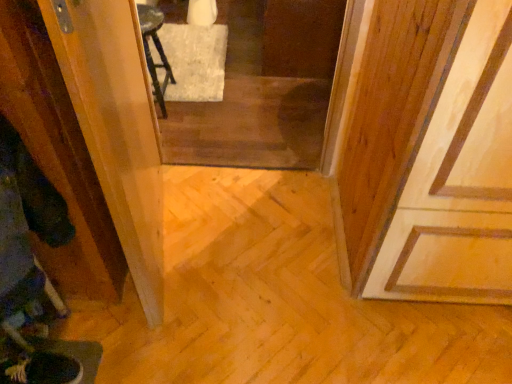
Looking at this image, in order to face transparent glass screen door at center, the 2th screen door positioned from the front, should I rotate leftwards or rightwards?

A 0.044 degree turn to the right will do.

Where is `transparent glass screen door at center, which is the first screen door from back to front`? transparent glass screen door at center, which is the first screen door from back to front is located at coordinates (263, 89).

The image size is (512, 384). Describe the element at coordinates (263, 89) in the screenshot. I see `transparent glass screen door at center, the 1th screen door viewed from the right` at that location.

What do you see at coordinates (116, 126) in the screenshot? This screenshot has width=512, height=384. I see `transparent plastic screen door at left, which ranks as the 1th screen door in front-to-back order` at bounding box center [116, 126].

Image resolution: width=512 pixels, height=384 pixels. Identify the location of transparent plastic screen door at left, which ranks as the 1th screen door in front-to-back order. (116, 126).

In order to face transparent plastic screen door at left, arranged as the 1th screen door when viewed from the left, should I rotate leftwards or rightwards?

You should look left and rotate roughly 14.684 degrees.

What is the approximate width of transparent plastic screen door at left, placed as the 2th screen door when sorted from right to left?

transparent plastic screen door at left, placed as the 2th screen door when sorted from right to left, is 9.73 centimeters wide.

I want to click on transparent glass screen door at center, arranged as the second screen door when viewed from the left, so click(x=263, y=89).

Considering the positions of objects transparent glass screen door at center, the 1th screen door viewed from the right, and transparent plastic screen door at left, the second screen door in the back-to-front sequence, in the image provided, who is more to the right, transparent glass screen door at center, the 1th screen door viewed from the right, or transparent plastic screen door at left, the second screen door in the back-to-front sequence,?

transparent glass screen door at center, the 1th screen door viewed from the right, is more to the right.

Is transparent glass screen door at center, arranged as the second screen door when viewed from the left, positioned in front of transparent plastic screen door at left, arranged as the 1th screen door when viewed from the left?

No, it is behind transparent plastic screen door at left, arranged as the 1th screen door when viewed from the left.

Which is closer, (180, 161) or (110, 56)?

Point (180, 161) is positioned farther from the camera compared to point (110, 56).

From the image's perspective, does transparent glass screen door at center, the 1th screen door viewed from the right, appear higher than transparent plastic screen door at left, the second screen door in the back-to-front sequence?

Yes, from the image's perspective, transparent glass screen door at center, the 1th screen door viewed from the right, is over transparent plastic screen door at left, the second screen door in the back-to-front sequence.

From a real-world perspective, which object rests below the other?

transparent glass screen door at center, arranged as the second screen door when viewed from the left, is physically lower.

Between transparent glass screen door at center, the 1th screen door viewed from the right, and transparent plastic screen door at left, placed as the 2th screen door when sorted from right to left, which one has larger width?

Wider between the two is transparent glass screen door at center, the 1th screen door viewed from the right.

Looking at this image, can you confirm if transparent glass screen door at center, the 2th screen door positioned from the front, is shorter than transparent plastic screen door at left, which ranks as the 1th screen door in front-to-back order?

Correct, transparent glass screen door at center, the 2th screen door positioned from the front, is not as tall as transparent plastic screen door at left, which ranks as the 1th screen door in front-to-back order.

Is transparent glass screen door at center, the 2th screen door positioned from the front, smaller than transparent plastic screen door at left, which ranks as the 1th screen door in front-to-back order?

Actually, transparent glass screen door at center, the 2th screen door positioned from the front, might be larger than transparent plastic screen door at left, which ranks as the 1th screen door in front-to-back order.

Is transparent glass screen door at center, the 2th screen door positioned from the front, located outside transparent plastic screen door at left, placed as the 2th screen door when sorted from right to left?

Yes, transparent glass screen door at center, the 2th screen door positioned from the front, is not within transparent plastic screen door at left, placed as the 2th screen door when sorted from right to left.

Is transparent glass screen door at center, the 2th screen door positioned from the front, with transparent plastic screen door at left, placed as the 2th screen door when sorted from right to left?

transparent glass screen door at center, the 2th screen door positioned from the front, is not next to transparent plastic screen door at left, placed as the 2th screen door when sorted from right to left, and they're not touching.

Is transparent glass screen door at center, the 1th screen door viewed from the right, facing towards transparent plastic screen door at left, which ranks as the 1th screen door in front-to-back order?

No.

Can you tell me how much transparent glass screen door at center, which is the first screen door from back to front, and transparent plastic screen door at left, which ranks as the 1th screen door in front-to-back order, differ in facing direction?

101 degrees.

How distant is transparent glass screen door at center, the 1th screen door viewed from the right, from transparent plastic screen door at left, arranged as the 1th screen door when viewed from the left?

79.12 centimeters.

This screenshot has height=384, width=512. Find the location of `screen door on the left of transparent glass screen door at center, arranged as the second screen door when viewed from the left`. screen door on the left of transparent glass screen door at center, arranged as the second screen door when viewed from the left is located at coordinates (116, 126).

Looking at this image, is transparent plastic screen door at left, placed as the 2th screen door when sorted from right to left, to the left of transparent glass screen door at center, the 2th screen door positioned from the front, from the viewer's perspective?

Indeed, transparent plastic screen door at left, placed as the 2th screen door when sorted from right to left, is positioned on the left side of transparent glass screen door at center, the 2th screen door positioned from the front.

Which object is more forward, transparent plastic screen door at left, placed as the 2th screen door when sorted from right to left, or transparent glass screen door at center, arranged as the second screen door when viewed from the left?

transparent plastic screen door at left, placed as the 2th screen door when sorted from right to left, is closer to the camera.

Is point (90, 11) closer or farther from the camera than point (260, 65)?

Point (90, 11).

From the image's perspective, which is above, transparent plastic screen door at left, placed as the 2th screen door when sorted from right to left, or transparent glass screen door at center, which is the first screen door from back to front?

transparent glass screen door at center, which is the first screen door from back to front, is shown above in the image.

Consider the image. From a real-world perspective, is transparent plastic screen door at left, the second screen door in the back-to-front sequence, on top of transparent glass screen door at center, arranged as the second screen door when viewed from the left?

Yes, from a real-world perspective, transparent plastic screen door at left, the second screen door in the back-to-front sequence, is on top of transparent glass screen door at center, arranged as the second screen door when viewed from the left.

Can you confirm if transparent plastic screen door at left, arranged as the 1th screen door when viewed from the left, is wider than transparent glass screen door at center, the 2th screen door positioned from the front?

Incorrect, the width of transparent plastic screen door at left, arranged as the 1th screen door when viewed from the left, does not surpass that of transparent glass screen door at center, the 2th screen door positioned from the front.

Looking at this image, considering the sizes of transparent plastic screen door at left, the second screen door in the back-to-front sequence, and transparent glass screen door at center, the 2th screen door positioned from the front, in the image, is transparent plastic screen door at left, the second screen door in the back-to-front sequence, taller or shorter than transparent glass screen door at center, the 2th screen door positioned from the front,?

Considering their sizes, transparent plastic screen door at left, the second screen door in the back-to-front sequence, has more height than transparent glass screen door at center, the 2th screen door positioned from the front.

Does transparent plastic screen door at left, which ranks as the 1th screen door in front-to-back order, have a larger size compared to transparent glass screen door at center, arranged as the second screen door when viewed from the left?

Incorrect, transparent plastic screen door at left, which ranks as the 1th screen door in front-to-back order, is not larger than transparent glass screen door at center, arranged as the second screen door when viewed from the left.

Would you say transparent plastic screen door at left, arranged as the 1th screen door when viewed from the left, is inside or outside transparent glass screen door at center, arranged as the second screen door when viewed from the left?

transparent plastic screen door at left, arranged as the 1th screen door when viewed from the left, is spatially situated outside transparent glass screen door at center, arranged as the second screen door when viewed from the left.

Can you see transparent plastic screen door at left, placed as the 2th screen door when sorted from right to left, touching transparent glass screen door at center, which is the first screen door from back to front?

No, transparent plastic screen door at left, placed as the 2th screen door when sorted from right to left, is not in contact with transparent glass screen door at center, which is the first screen door from back to front.

Is transparent glass screen door at center, arranged as the second screen door when viewed from the left, at the back of transparent plastic screen door at left, the second screen door in the back-to-front sequence?

No, transparent plastic screen door at left, the second screen door in the back-to-front sequence, is not facing away from transparent glass screen door at center, arranged as the second screen door when viewed from the left.

Can you tell me how much transparent plastic screen door at left, placed as the 2th screen door when sorted from right to left, and transparent glass screen door at center, the 2th screen door positioned from the front, differ in facing direction?

transparent plastic screen door at left, placed as the 2th screen door when sorted from right to left, and transparent glass screen door at center, the 2th screen door positioned from the front, are facing 101 degrees away from each other.

This screenshot has width=512, height=384. In order to click on screen door that is on the right side of transparent plastic screen door at left, placed as the 2th screen door when sorted from right to left in this screenshot , I will do `click(263, 89)`.

Locate an element on the screen. screen door that is below the transparent glass screen door at center, which is the first screen door from back to front (from the image's perspective) is located at coordinates (116, 126).

I want to click on screen door that appears below the transparent plastic screen door at left, which ranks as the 1th screen door in front-to-back order (from a real-world perspective), so click(263, 89).